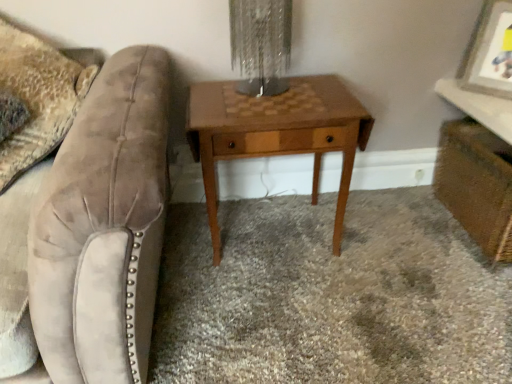
What is the approximate height of velvet swivel chair at left?

The height of velvet swivel chair at left is 29.16 inches.

This screenshot has width=512, height=384. What do you see at coordinates (489, 52) in the screenshot?
I see `wooden picture frame at upper right` at bounding box center [489, 52].

Describe the element at coordinates (38, 97) in the screenshot. I see `velvet beige throw pillow at left` at that location.

Identify the location of velvet beige throw pillow at left. The height and width of the screenshot is (384, 512). (38, 97).

The image size is (512, 384). Find the location of `brown wood table at center`. brown wood table at center is located at coordinates (329, 295).

This screenshot has width=512, height=384. What do you see at coordinates (477, 169) in the screenshot?
I see `wooden vanity at lower right` at bounding box center [477, 169].

Where is `velvet swivel chair at left`? The image size is (512, 384). velvet swivel chair at left is located at coordinates (104, 226).

How distant is wooden picture frame at upper right from velvet beige throw pillow at left?

wooden picture frame at upper right and velvet beige throw pillow at left are 1.51 meters apart.

Is wooden picture frame at upper right not within velvet beige throw pillow at left?

Yes.

Considering the sizes of objects wooden picture frame at upper right and velvet beige throw pillow at left in the image provided, who is thinner, wooden picture frame at upper right or velvet beige throw pillow at left?

With smaller width is wooden picture frame at upper right.

Consider the image. From the image's perspective, who appears lower, wooden picture frame at upper right or velvet beige throw pillow at left?

velvet beige throw pillow at left.

Can you confirm if woodenmaterial/texturenightstand at center is wider than wooden picture frame at upper right?

Indeed, woodenmaterial/texturenightstand at center has a greater width compared to wooden picture frame at upper right.

Considering the positions of objects woodenmaterial/texturenightstand at center and wooden picture frame at upper right in the image provided, who is behind, woodenmaterial/texturenightstand at center or wooden picture frame at upper right?

wooden picture frame at upper right is behind.

From the image's perspective, which one is positioned higher, woodenmaterial/texturenightstand at center or wooden picture frame at upper right?

wooden picture frame at upper right, from the image's perspective.

Considering the sizes of woodenmaterial/texturenightstand at center and wooden picture frame at upper right in the image, is woodenmaterial/texturenightstand at center taller or shorter than wooden picture frame at upper right?

Considering their sizes, woodenmaterial/texturenightstand at center has more height than wooden picture frame at upper right.

Which is more to the right, brown wood table at center or wooden picture frame at upper right?

wooden picture frame at upper right is more to the right.

How many degrees apart are the facing directions of brown wood table at center and wooden picture frame at upper right?

There is a 43.1-degree angle between the facing directions of brown wood table at center and wooden picture frame at upper right.

The image size is (512, 384). Identify the location of picture frame that is on the right side of brown wood table at center. (489, 52).

From a real-world perspective, is wooden vanity at lower right over metallic textured lampshade at center?

No.

From the image's perspective, is wooden vanity at lower right over metallic textured lampshade at center?

No, from the image's perspective, wooden vanity at lower right is not above metallic textured lampshade at center.

Is wooden vanity at lower right shorter than metallic textured lampshade at center?

No.

The width and height of the screenshot is (512, 384). I want to click on table lamp above the wooden vanity at lower right (from the image's perspective), so click(x=261, y=44).

Is brown wood table at center facing away from velvet swivel chair at left?

brown wood table at center does not have its back to velvet swivel chair at left.

Is brown wood table at center inside the boundaries of velvet swivel chair at left, or outside?

brown wood table at center is located beyond the bounds of velvet swivel chair at left.

From the picture: How many degrees apart are the facing directions of brown wood table at center and velvet swivel chair at left?

The angle between the facing direction of brown wood table at center and the facing direction of velvet swivel chair at left is 91 degrees.

Does metallic textured lampshade at center contain brown wood table at center?

No, brown wood table at center is not a part of metallic textured lampshade at center.

How different are the orientations of metallic textured lampshade at center and brown wood table at center in degrees?

The facing directions of metallic textured lampshade at center and brown wood table at center are 91 degrees apart.

Does metallic textured lampshade at center lie in front of brown wood table at center?

No, it is not.

From a real-world perspective, is metallic textured lampshade at center on brown wood table at center?

Correct, in the physical world, metallic textured lampshade at center is higher than brown wood table at center.

Is wooden vanity at lower right not inside wooden picture frame at upper right?

Yes.

Consider the image. Measure the distance from wooden vanity at lower right to wooden picture frame at upper right.

wooden vanity at lower right is 9.78 inches away from wooden picture frame at upper right.

Looking at the image, does wooden vanity at lower right seem bigger or smaller compared to wooden picture frame at upper right?

wooden vanity at lower right is bigger than wooden picture frame at upper right.

Is point (457, 151) positioned in front of point (506, 64)?

No, it is behind (506, 64).

Find the location of `throw pillow in front of the wooden picture frame at upper right`. throw pillow in front of the wooden picture frame at upper right is located at coordinates (38, 97).

Where is `picture frame that appears above the woodenmaterial/texturenightstand at center (from a real-world perspective)`? This screenshot has width=512, height=384. picture frame that appears above the woodenmaterial/texturenightstand at center (from a real-world perspective) is located at coordinates (489, 52).

Looking at the image, which one is located further to metallic textured lampshade at center, woodenmaterial/texturenightstand at center or brown wood table at center?

brown wood table at center is positioned further to the anchor metallic textured lampshade at center.

Estimate the real-world distances between objects in this image. Which object is further from velvet beige throw pillow at left, velvet swivel chair at left or wooden vanity at lower right?

wooden vanity at lower right.

Based on their spatial positions, is metallic textured lampshade at center or velvet beige throw pillow at left closer to velvet swivel chair at left?

velvet beige throw pillow at left is positioned closer to the anchor velvet swivel chair at left.

When comparing their distances from metallic textured lampshade at center, does velvet beige throw pillow at left or wooden picture frame at upper right seem further?

The object further to metallic textured lampshade at center is wooden picture frame at upper right.

Which object lies further to the anchor point velvet beige throw pillow at left, metallic textured lampshade at center or wooden picture frame at upper right?

Based on the image, wooden picture frame at upper right appears to be further to velvet beige throw pillow at left.

When comparing their distances from velvet beige throw pillow at left, does wooden picture frame at upper right or brown wood table at center seem further?

The object further to velvet beige throw pillow at left is wooden picture frame at upper right.

Looking at the image, which one is located closer to brown wood table at center, metallic textured lampshade at center or velvet swivel chair at left?

velvet swivel chair at left is positioned closer to the anchor brown wood table at center.

When comparing their distances from velvet swivel chair at left, does metallic textured lampshade at center or wooden picture frame at upper right seem further?

wooden picture frame at upper right is positioned further to the anchor velvet swivel chair at left.

The width and height of the screenshot is (512, 384). I want to click on plain between woodenmaterial/texturenightstand at center and wooden vanity at lower right from left to right, so click(329, 295).

Find the location of `table lamp between velvet swivel chair at left and brown wood table at center`. table lamp between velvet swivel chair at left and brown wood table at center is located at coordinates (261, 44).

Locate an element on the screen. plain between metallic textured lampshade at center and wooden vanity at lower right is located at coordinates (329, 295).

Where is `table lamp situated between velvet beige throw pillow at left and wooden vanity at lower right from left to right`? table lamp situated between velvet beige throw pillow at left and wooden vanity at lower right from left to right is located at coordinates (261, 44).